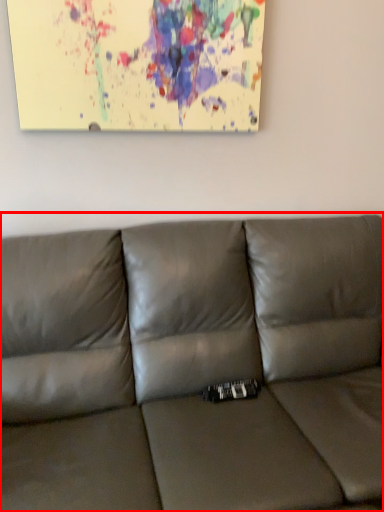
Question: Observing the image, what is the correct spatial positioning of studio couch (annotated by the red box) in reference to picture frame?

Choices:
 (A) left
 (B) right

Answer: (B)